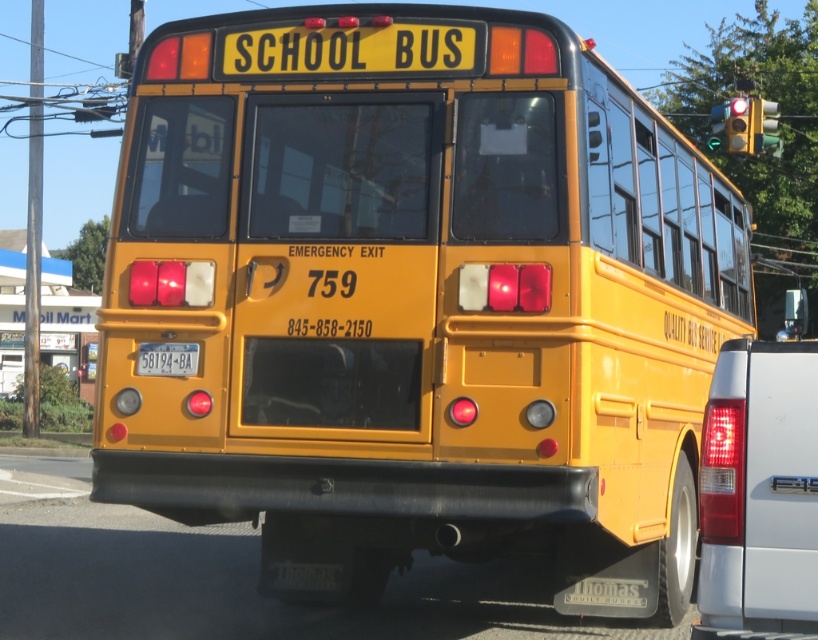
Is matte white tail light at rear to the right of yellow plastic license plate at center from the viewer's perspective?

Correct, you'll find matte white tail light at rear to the right of yellow plastic license plate at center.

Can you confirm if matte white tail light at rear is taller than yellow plastic license plate at center?

Indeed, matte white tail light at rear has a greater height compared to yellow plastic license plate at center.

Which is behind, point (789, 497) or point (137, 365)?

Positioned behind is point (137, 365).

This screenshot has height=640, width=818. What are the coordinates of `matte white tail light at rear` in the screenshot? It's located at (758, 492).